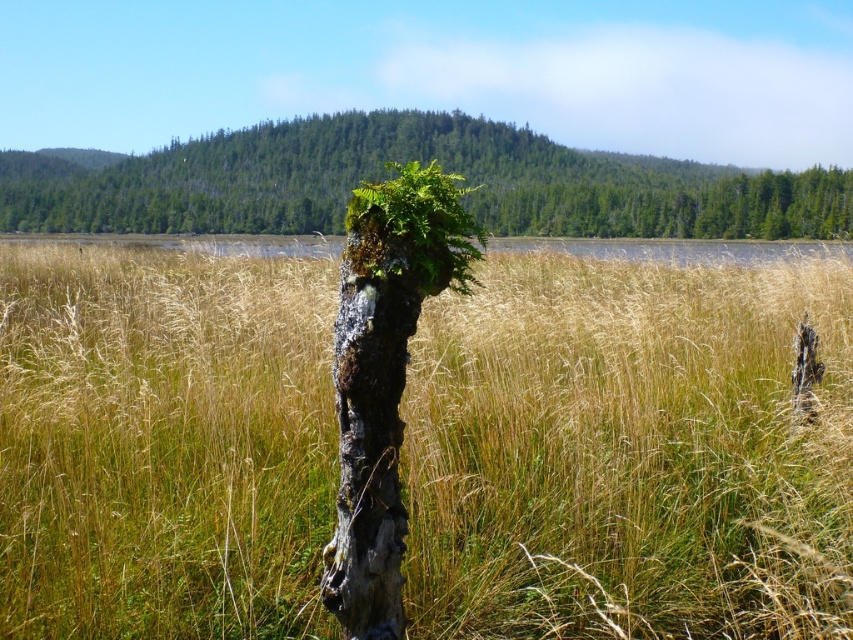
Question: Which object appears closest to the camera in this image?

Choices:
 (A) grayish-brown bark tree trunk at center
 (B) brown grassy at center
 (C) green mossy stump at center
 (D) green mossy fern at center

Answer: (A)

Question: Which is farther from the brown grassy at center?

Choices:
 (A) green mossy stump at center
 (B) green mossy fern at center

Answer: (A)

Question: Is green mossy stump at center positioned at the back of grayish-brown bark tree trunk at center?

Choices:
 (A) no
 (B) yes

Answer: (B)

Question: Which point is farther to the camera?

Choices:
 (A) (370, 214)
 (B) (409, 326)
 (C) (223, 145)
 (D) (44, 262)

Answer: (C)

Question: Is the position of brown grassy at center more distant than that of green mossy stump at center?

Choices:
 (A) no
 (B) yes

Answer: (A)

Question: Can you confirm if brown grassy at center is smaller than green mossy stump at center?

Choices:
 (A) no
 (B) yes

Answer: (B)